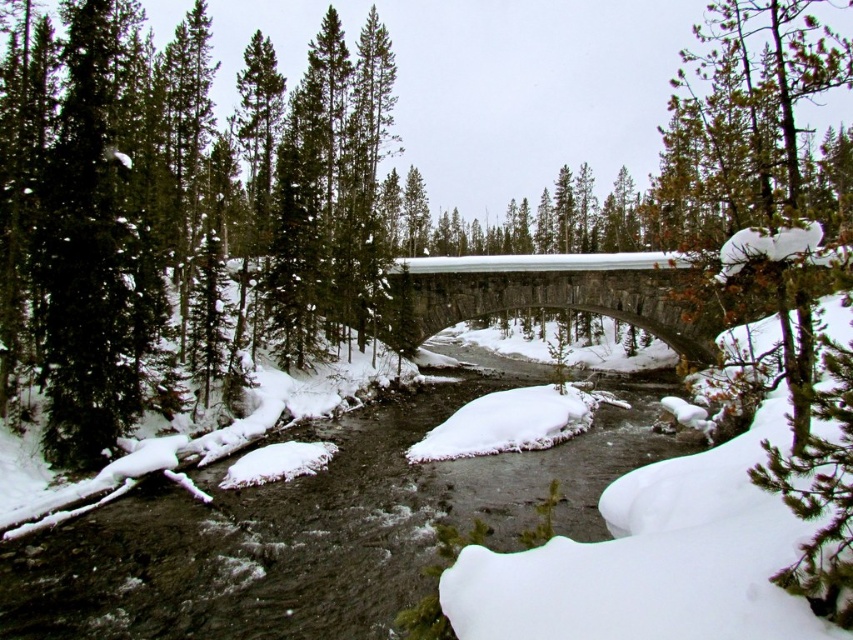
Which is behind, point (285, 324) or point (618, 314)?

The point (618, 314) is behind.

Can you confirm if green matte tree at left is positioned below gray stone bridge at center?

No.

Describe the element at coordinates (172, 209) in the screenshot. I see `green matte tree at left` at that location.

Locate an element on the screen. The image size is (853, 640). green matte tree at left is located at coordinates (172, 209).